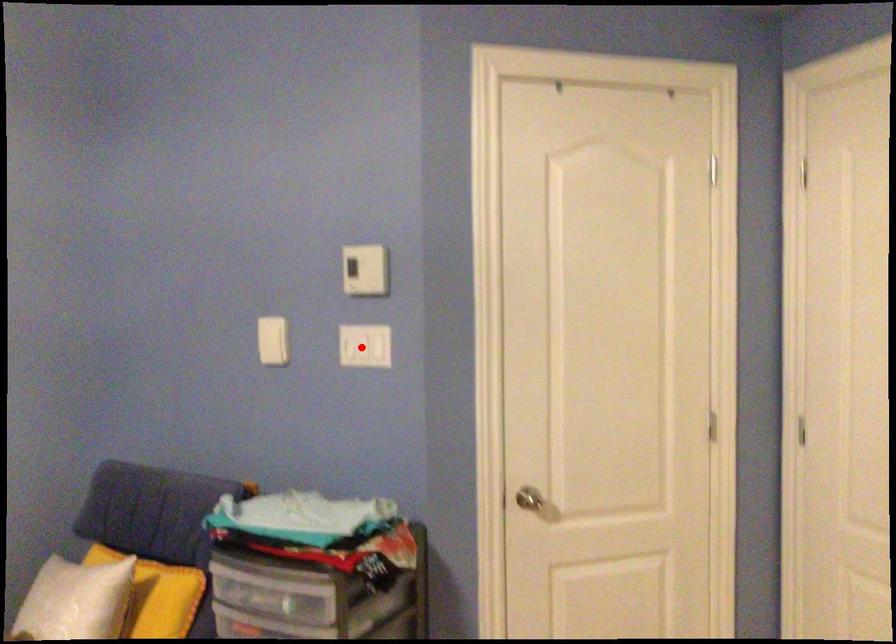
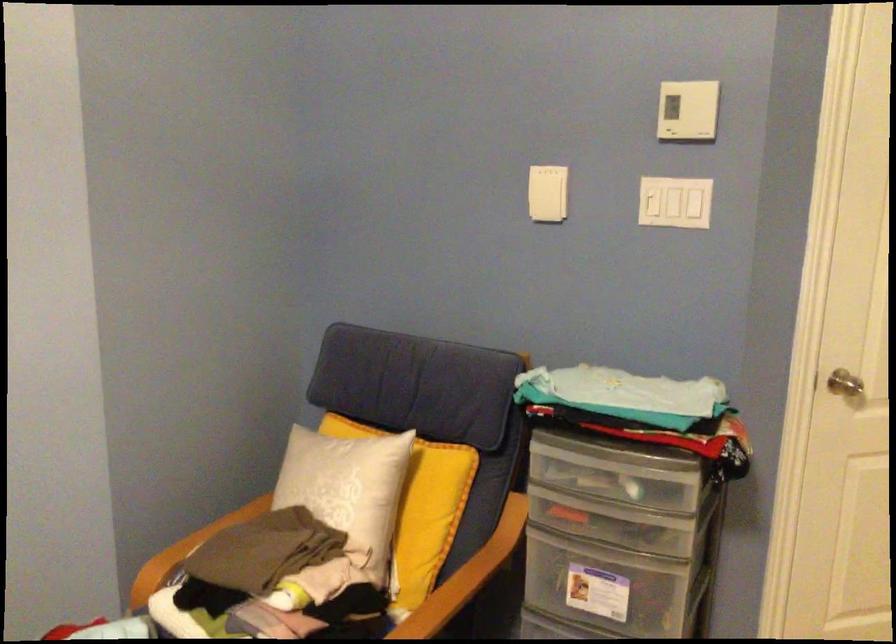
Locate, in the second image, the point that corresponds to the highlighted location in the first image.

(675, 202)